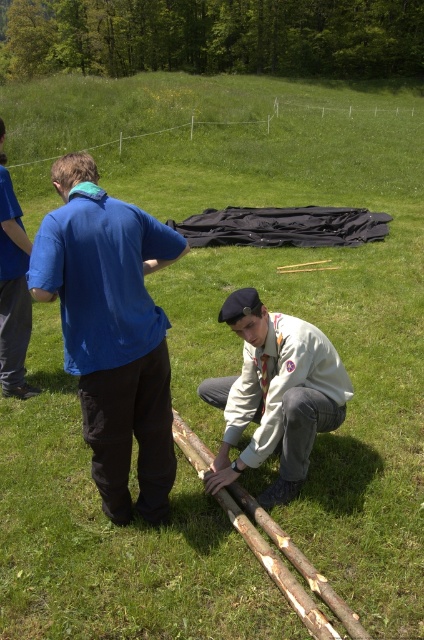
Question: Among these objects, which one is farthest from the camera?

Choices:
 (A) white matte uniform at center
 (B) blue cotton shirt at center
 (C) blue cotton shirt at left

Answer: (C)

Question: Is blue cotton shirt at center smaller than blue cotton shirt at left?

Choices:
 (A) yes
 (B) no

Answer: (B)

Question: Which object is farther from the camera taking this photo?

Choices:
 (A) white matte uniform at center
 (B) blue cotton shirt at center
 (C) blue cotton shirt at left

Answer: (C)

Question: Which point is farther to the camera?

Choices:
 (A) (5, 211)
 (B) (103, 461)

Answer: (A)

Question: Is white matte uniform at center above blue cotton shirt at left?

Choices:
 (A) yes
 (B) no

Answer: (B)

Question: Does blue cotton shirt at center have a larger size compared to blue cotton shirt at left?

Choices:
 (A) no
 (B) yes

Answer: (B)